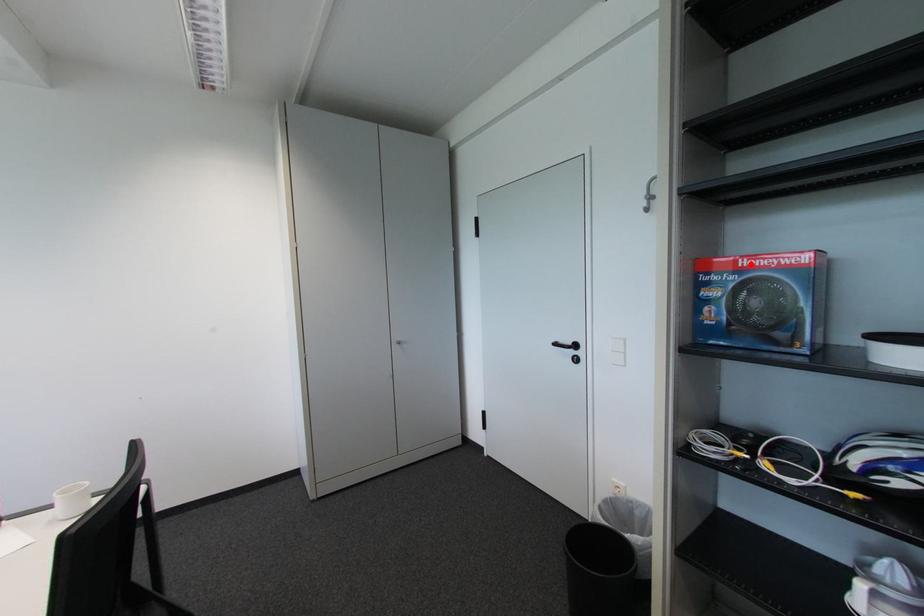
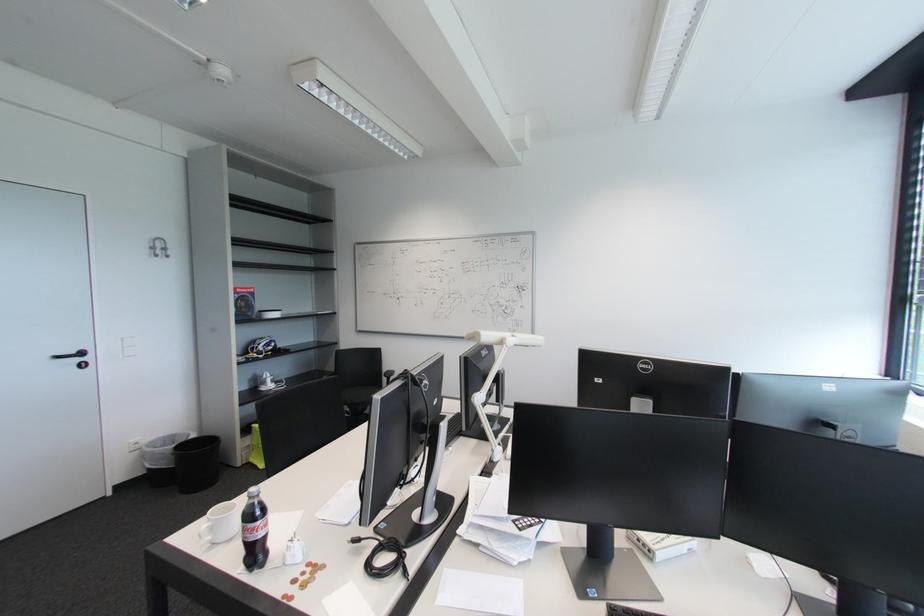
Where in the second image is the point corresponding to the highlighted location from the first image?

(246, 292)